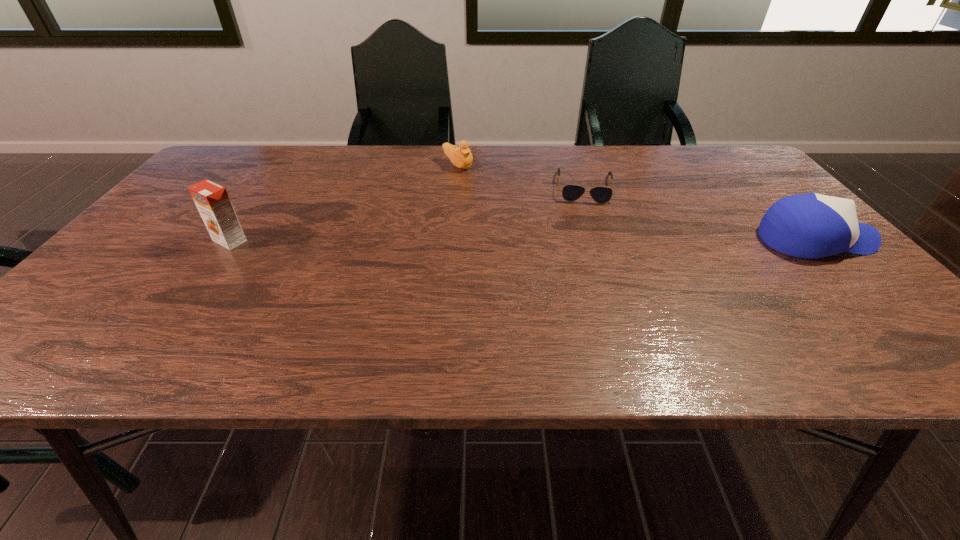
Find the location of a particular element. Image resolution: width=960 pixels, height=540 pixels. the leftmost object is located at coordinates (212, 201).

You are a GUI agent. You are given a task and a screenshot of the screen. Output one action in this format:
    pyautogui.click(x=<x>, y=<y>)
    Task: Click on the tallest object
    The width and height of the screenshot is (960, 540).
    Given the screenshot: What is the action you would take?
    pyautogui.click(x=212, y=201)

In order to click on baseball cap in this screenshot , I will do `click(812, 225)`.

Locate an element on the screen. This screenshot has height=540, width=960. the rightmost object is located at coordinates (812, 225).

Locate an element on the screen. the second shortest object is located at coordinates (461, 157).

The width and height of the screenshot is (960, 540). Find the location of `the third object from right to left`. the third object from right to left is located at coordinates (461, 157).

Locate an element on the screen. The height and width of the screenshot is (540, 960). sunglasses is located at coordinates (600, 194).

Image resolution: width=960 pixels, height=540 pixels. Identify the location of the third object from left to right. (600, 194).

Where is `vacant area situated 0.230m on the front of the leftmost object`? Image resolution: width=960 pixels, height=540 pixels. vacant area situated 0.230m on the front of the leftmost object is located at coordinates (171, 322).

This screenshot has width=960, height=540. What are the coordinates of `vacant space located 0.120m on the face of the second shortest object` in the screenshot? It's located at (495, 186).